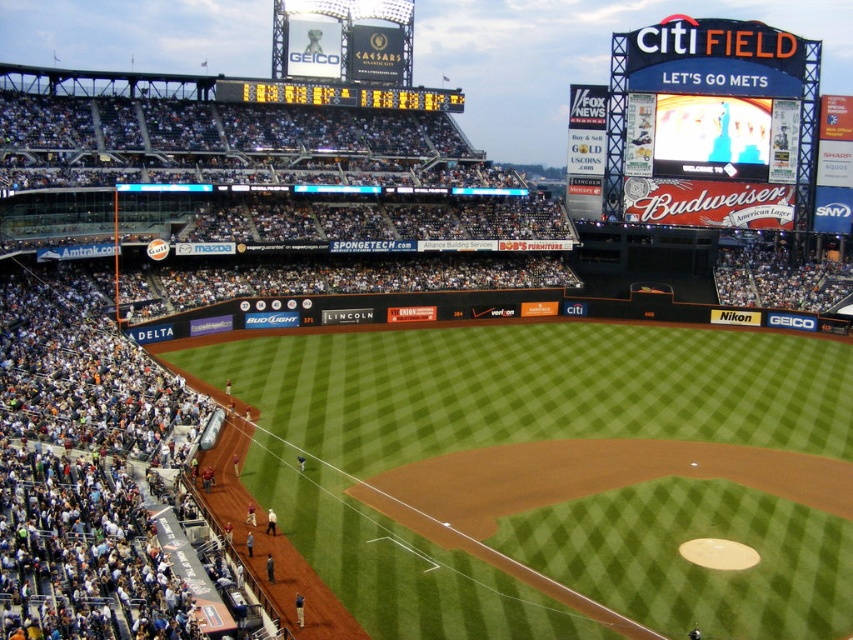
Is blue plastic scoreboard at upper right positioned in front of yellow digital scoreboard at upper center?

No, blue plastic scoreboard at upper right is behind yellow digital scoreboard at upper center.

Does point (624, 134) lie in front of point (421, 106)?

No, (624, 134) is further to viewer.

This screenshot has width=853, height=640. I want to click on blue plastic scoreboard at upper right, so click(x=616, y=125).

Is green grass baseball field at lower left positioned behind yellow digital scoreboard at upper center?

No, it is not.

Does green grass baseball field at lower left have a larger size compared to yellow digital scoreboard at upper center?

Correct, green grass baseball field at lower left is larger in size than yellow digital scoreboard at upper center.

Where is `green grass baseball field at lower left`? This screenshot has width=853, height=640. green grass baseball field at lower left is located at coordinates (498, 435).

Identify the location of green grass baseball field at lower left. The image size is (853, 640). (498, 435).

Image resolution: width=853 pixels, height=640 pixels. What are the coordinates of `green grass baseball field at lower left` in the screenshot? It's located at (498, 435).

What do you see at coordinates (498, 435) in the screenshot?
I see `green grass baseball field at lower left` at bounding box center [498, 435].

Find the location of a particular element. This screenshot has height=640, width=853. green grass baseball field at lower left is located at coordinates (498, 435).